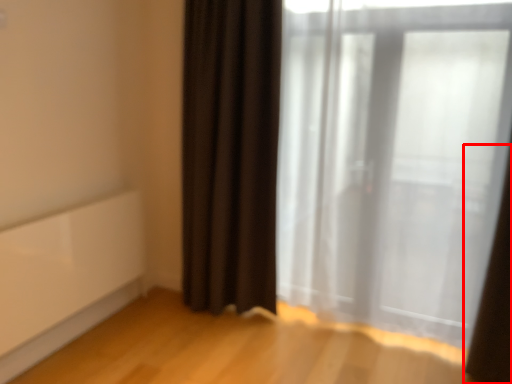
Question: Observing the image, what is the correct spatial positioning of curtain (annotated by the red box) in reference to curtain?

Choices:
 (A) right
 (B) left

Answer: (A)